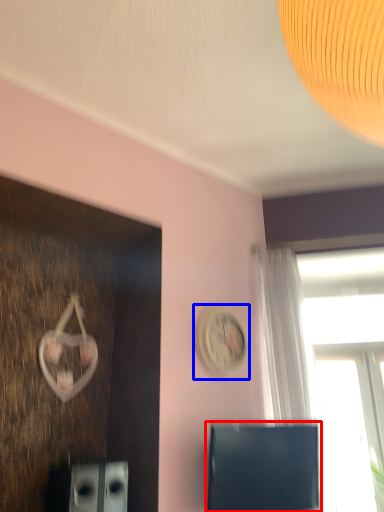
Question: Among these objects, which one is nearest to the camera, computer monitor (highlighted by a red box) or clock (highlighted by a blue box)?

Choices:
 (A) computer monitor
 (B) clock

Answer: (A)